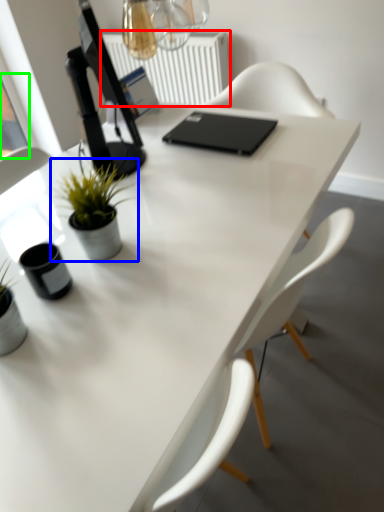
Question: Which object is the closest to the radiator (highlighted by a red box)? Choose among these: houseplant (highlighted by a blue box) or window screen (highlighted by a green box).

Choices:
 (A) houseplant
 (B) window screen

Answer: (B)